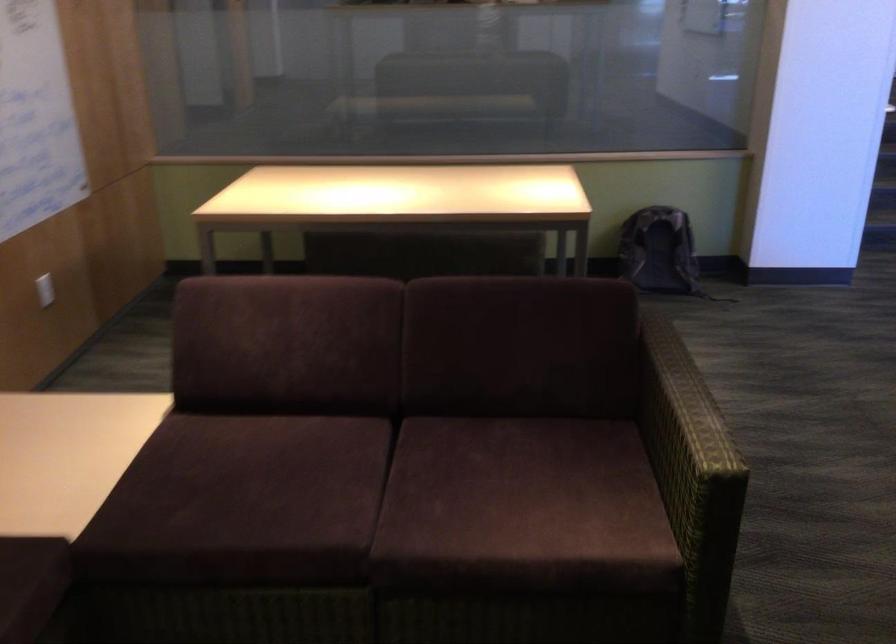
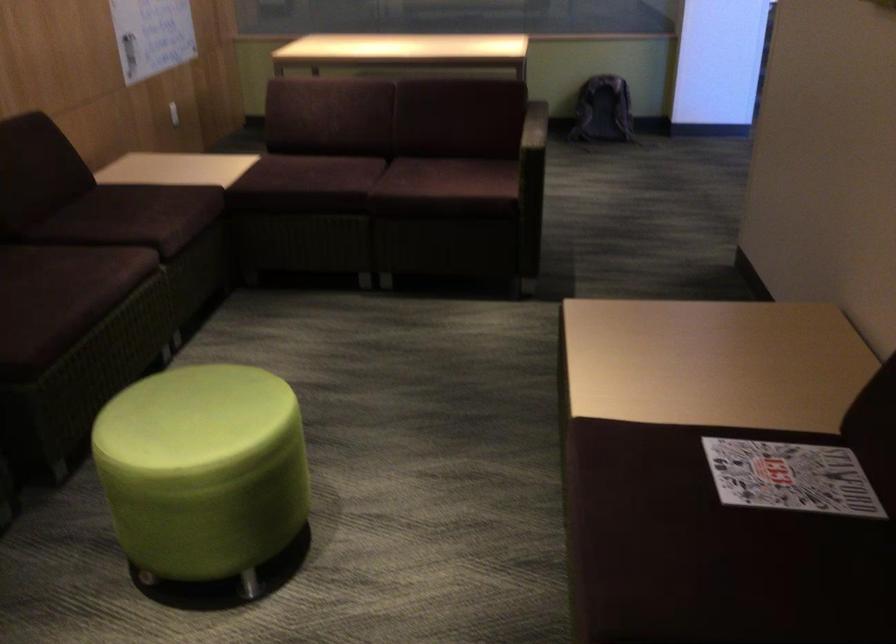
The point at [650,274] is marked in the first image. Where is the corresponding point in the second image?

(602, 109)